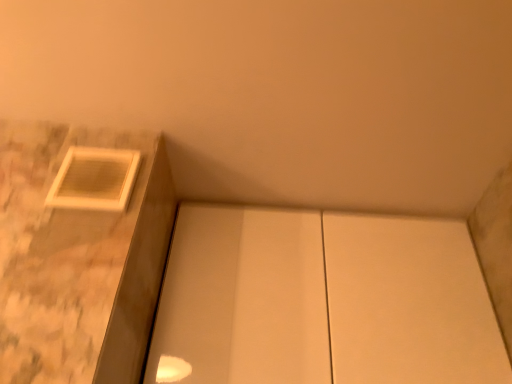
Locate an element on the screen. matte white frame at upper left is located at coordinates (95, 179).

This screenshot has height=384, width=512. What do you see at coordinates (95, 179) in the screenshot? I see `matte white frame at upper left` at bounding box center [95, 179].

What do you see at coordinates (323, 301) in the screenshot?
I see `white matte cabinet at center` at bounding box center [323, 301].

The height and width of the screenshot is (384, 512). In order to click on white matte cabinet at center in this screenshot , I will do `click(323, 301)`.

In order to click on matte white frame at upper left in this screenshot , I will do `click(95, 179)`.

Considering the positions of objects matte white frame at upper left and white matte cabinet at center in the image provided, who is more to the right, matte white frame at upper left or white matte cabinet at center?

Positioned to the right is white matte cabinet at center.

Considering the relative positions of matte white frame at upper left and white matte cabinet at center in the image provided, is matte white frame at upper left behind white matte cabinet at center?

That is False.

Between point (93, 168) and point (374, 285), which one is positioned in front?

The point (93, 168) is in front.

From the image's perspective, who appears lower, matte white frame at upper left or white matte cabinet at center?

white matte cabinet at center is shown below in the image.

From a real-world perspective, between matte white frame at upper left and white matte cabinet at center, who is vertically higher?

matte white frame at upper left is physically above.

Is matte white frame at upper left wider or thinner than white matte cabinet at center?

matte white frame at upper left is thinner than white matte cabinet at center.

Considering the sizes of objects matte white frame at upper left and white matte cabinet at center in the image provided, who is shorter, matte white frame at upper left or white matte cabinet at center?

matte white frame at upper left is shorter.

Based on their sizes in the image, would you say matte white frame at upper left is bigger or smaller than white matte cabinet at center?

Considering their sizes, matte white frame at upper left takes up less space than white matte cabinet at center.

Is matte white frame at upper left positioned beyond the bounds of white matte cabinet at center?

Yes, matte white frame at upper left is not within white matte cabinet at center.

Is matte white frame at upper left far from white matte cabinet at center?

No, matte white frame at upper left is not far away from white matte cabinet at center.

Is matte white frame at upper left facing away from white matte cabinet at center?

No, matte white frame at upper left is not facing away from white matte cabinet at center.

Identify the location of cabinetry that appears below the matte white frame at upper left (from the image's perspective). This screenshot has width=512, height=384. (323, 301).

Considering the positions of objects white matte cabinet at center and matte white frame at upper left in the image provided, who is more to the left, white matte cabinet at center or matte white frame at upper left?

From the viewer's perspective, matte white frame at upper left appears more on the left side.

Which object is more forward, white matte cabinet at center or matte white frame at upper left?

matte white frame at upper left is closer to the camera.

Is point (182, 206) closer or farther from the camera than point (109, 185)?

Point (182, 206).

From the image's perspective, is white matte cabinet at center below matte white frame at upper left?

Yes, from the image's perspective, white matte cabinet at center is below matte white frame at upper left.

From a real-world perspective, is white matte cabinet at center physically below matte white frame at upper left?

Indeed, from a real-world perspective, white matte cabinet at center is positioned beneath matte white frame at upper left.

Between white matte cabinet at center and matte white frame at upper left, which one has smaller width?

With smaller width is matte white frame at upper left.

Does white matte cabinet at center have a greater height compared to matte white frame at upper left?

Yes, white matte cabinet at center is taller than matte white frame at upper left.

Looking at the image, does white matte cabinet at center seem bigger or smaller compared to matte white frame at upper left?

Considering their sizes, white matte cabinet at center takes up more space than matte white frame at upper left.

Is white matte cabinet at center not inside matte white frame at upper left?

Indeed, white matte cabinet at center is completely outside matte white frame at upper left.

Is white matte cabinet at center touching matte white frame at upper left?

white matte cabinet at center and matte white frame at upper left are not in contact.

Is white matte cabinet at center facing away from matte white frame at upper left?

No, matte white frame at upper left is not at the back of white matte cabinet at center.

The width and height of the screenshot is (512, 384). What are the coordinates of `window located above the white matte cabinet at center (from the image's perspective)` in the screenshot? It's located at (95, 179).

This screenshot has width=512, height=384. In order to click on window on the left of white matte cabinet at center in this screenshot , I will do `click(95, 179)`.

Find the location of a particular element. The image size is (512, 384). window above the white matte cabinet at center (from the image's perspective) is located at coordinates (95, 179).